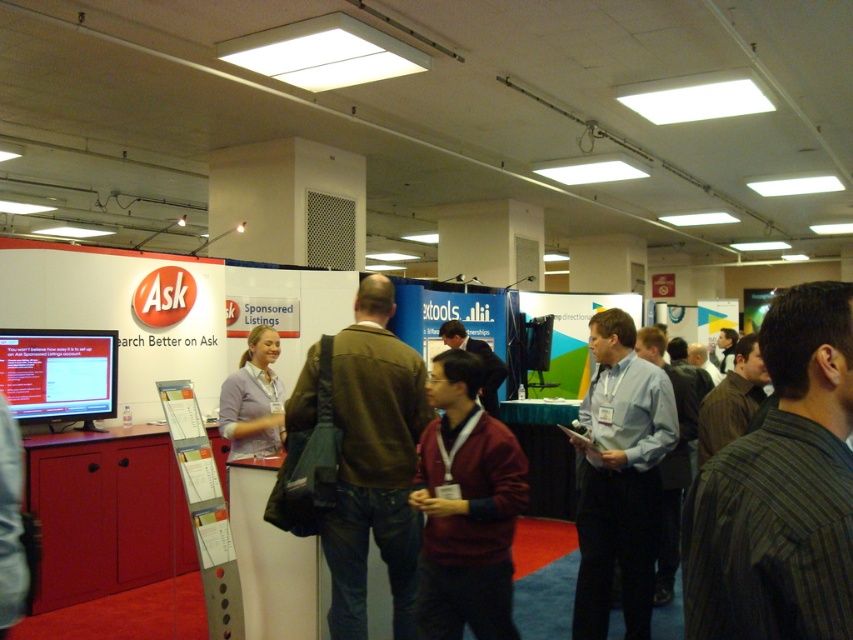
Is point (479, 605) more distant than point (277, 392)?

No, (479, 605) is in front of (277, 392).

Is maroon sweater at center below light purple shirt at center?

Yes.

Where is `maroon sweater at center`? maroon sweater at center is located at coordinates (465, 508).

Who is taller, striped cotton shirt at center or light blue shirt at center?

light blue shirt at center is taller.

Can you confirm if striped cotton shirt at center is smaller than light blue shirt at center?

Yes, striped cotton shirt at center is smaller than light blue shirt at center.

Is point (828, 467) behind point (625, 596)?

No, it is not.

Find the location of `striped cotton shirt at center`. striped cotton shirt at center is located at coordinates (780, 490).

Can you confirm if light blue shirt at center is positioned above dark brown leather jacket at center?

No.

Between point (643, 516) and point (440, 326), which one is positioned in front?

Point (643, 516)

Is point (575, 609) farther from viewer compared to point (465, 340)?

No.

Identify the location of light blue shirt at center. The width and height of the screenshot is (853, 640). (619, 477).